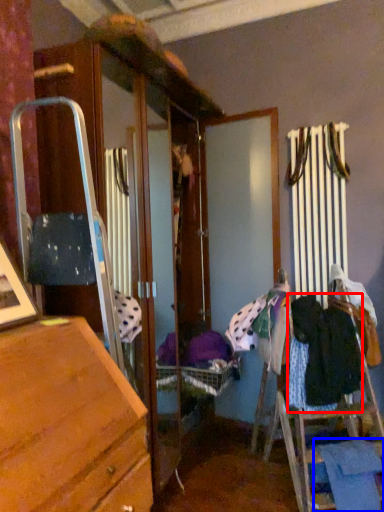
Question: Which of the following is the closest to the observer, clothing (highlighted by a red box) or clothing (highlighted by a blue box)?

Choices:
 (A) clothing
 (B) clothing

Answer: (B)